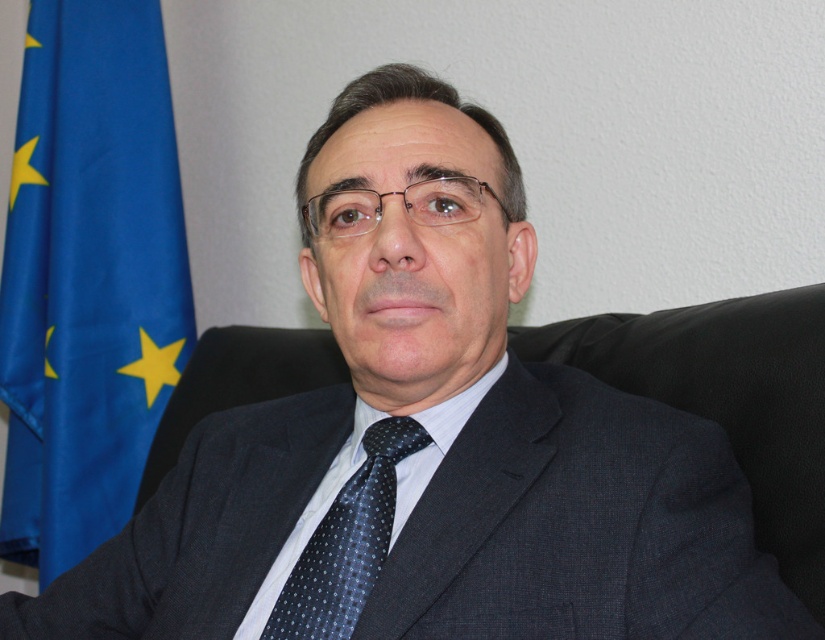
Can you confirm if blue fabric flag at left is bigger than dark blue dotted silk tie at center?

Indeed, blue fabric flag at left has a larger size compared to dark blue dotted silk tie at center.

Is point (144, 52) more distant than point (337, 504)?

That is True.

You are a GUI agent. You are given a task and a screenshot of the screen. Output one action in this format:
    pyautogui.click(x=<x>, y=<y>)
    Task: Click on the blue fabric flag at left
    The width and height of the screenshot is (825, 640).
    Given the screenshot: What is the action you would take?
    88,276